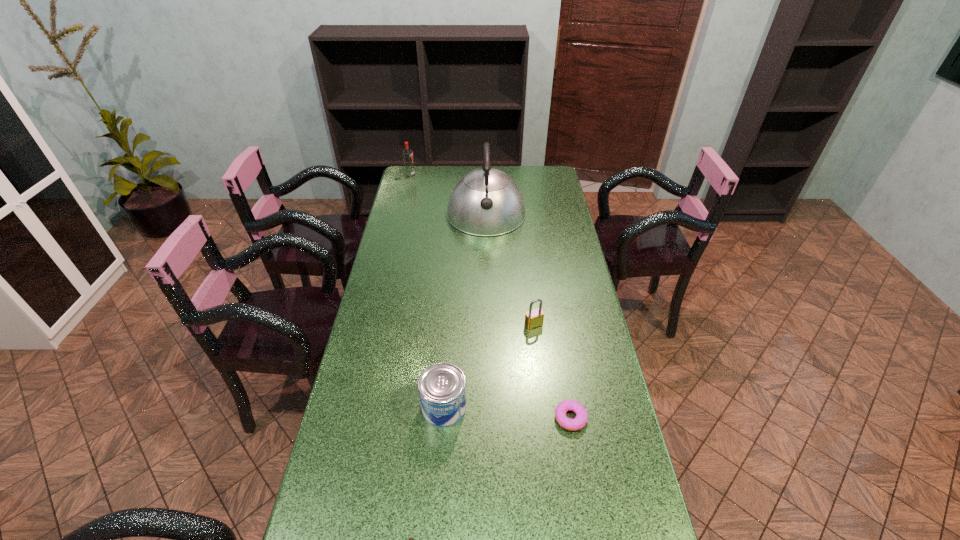
In order to click on free space that satisfies the following two spatial constraints: 1. from the spout of the second farthest object; 2. on the right side of the shortest object in this screenshot , I will do `click(490, 418)`.